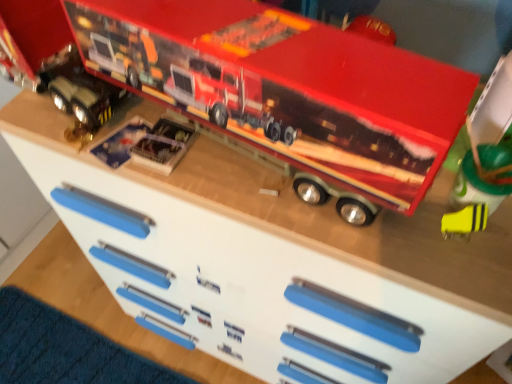
The image size is (512, 384). I want to click on free location to the right of clear plastic toy at center, which is counted as the third toy, starting from the right, so (x=253, y=184).